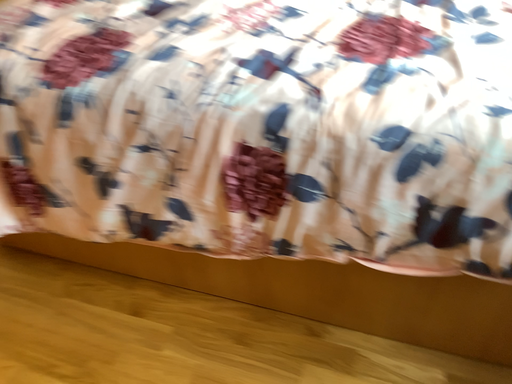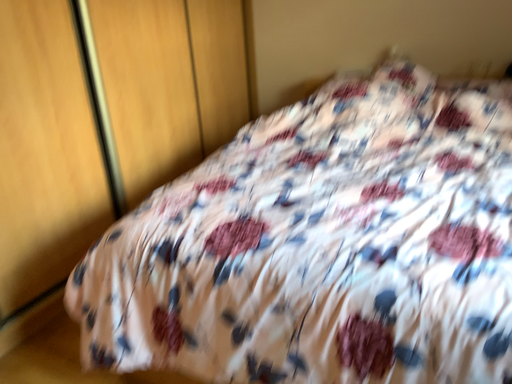
Question: Which way did the camera rotate in the video?

Choices:
 (A) rotated upward
 (B) rotated downward

Answer: (A)